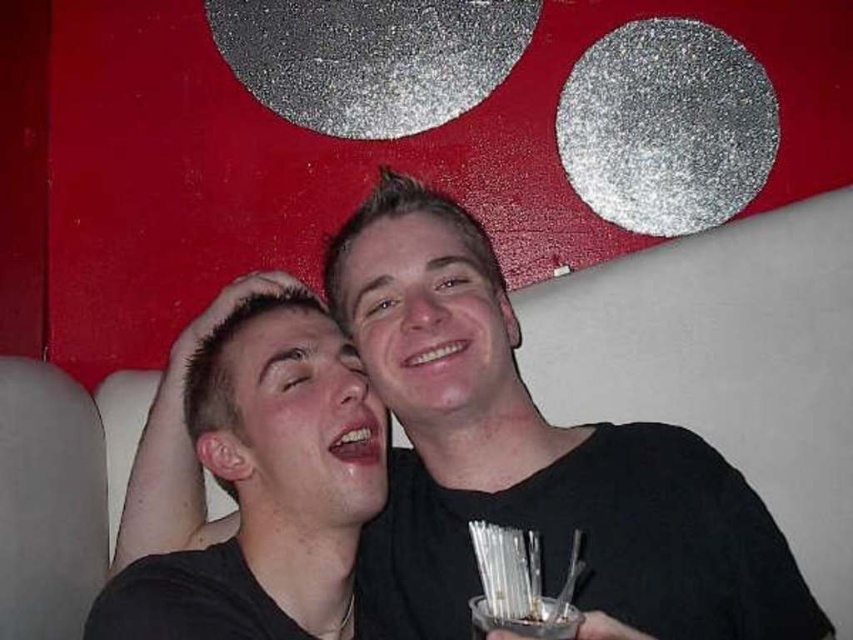
You are a photographer adjusting the lighting for a portrait session. You notice the black matte shirt at center and the smooth skin face at center in your frame. Which object should you focus on first if you want to ensure the larger one is properly lit?

The black matte shirt at center is larger in size than the smooth skin face at center, so you should focus on lighting the black matte shirt at center first.

You are a photographer adjusting the lighting for a portrait. You notice the smooth skin face at center and the clear plastic cup at lower center. Which object should you focus on first if you want to ensure the subject with the larger size is properly lit?

You should focus on the smooth skin face at center first because it is larger in size than the clear plastic cup at lower center, making it the primary subject for proper lighting.

You are standing in front of the image and want to locate the black matte shirt at center. What are its coordinates?

The black matte shirt at center is located at coordinates point (532, 452).